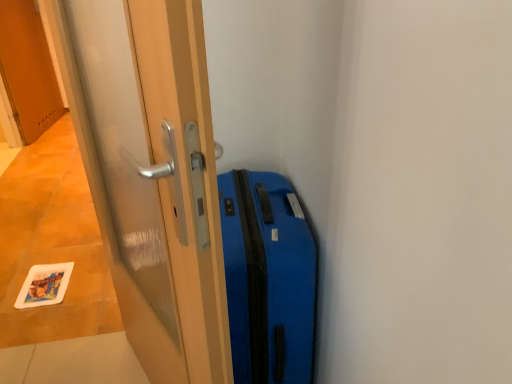
Question: Is transparent glass door at center, which ranks as the 2th door in back-to-front order, at the left side of blue matte suitcase at right?

Choices:
 (A) yes
 (B) no

Answer: (A)

Question: Does transparent glass door at center, marked as the second door in a left-to-right arrangement, have a greater height compared to blue matte suitcase at right?

Choices:
 (A) no
 (B) yes

Answer: (B)

Question: From the image's perspective, is transparent glass door at center, positioned as the second door in top-to-bottom order, on blue matte suitcase at right?

Choices:
 (A) yes
 (B) no

Answer: (A)

Question: Considering the relative sizes of transparent glass door at center, marked as the second door in a left-to-right arrangement, and blue matte suitcase at right in the image provided, is transparent glass door at center, marked as the second door in a left-to-right arrangement, smaller than blue matte suitcase at right?

Choices:
 (A) yes
 (B) no

Answer: (B)

Question: Would you consider transparent glass door at center, arranged as the 1th door when viewed from the front, to be distant from blue matte suitcase at right?

Choices:
 (A) no
 (B) yes

Answer: (A)

Question: Considering the positions of blue matte suitcase at right and wooden door at upper left, acting as the 1th door starting from the top, in the image, is blue matte suitcase at right taller or shorter than wooden door at upper left, acting as the 1th door starting from the top,?

Choices:
 (A) tall
 (B) short

Answer: (B)

Question: Does point (270, 278) appear closer or farther from the camera than point (42, 44)?

Choices:
 (A) closer
 (B) farther

Answer: (A)

Question: From a real-world perspective, is blue matte suitcase at right physically located above or below wooden door at upper left, the second door in the right-to-left sequence?

Choices:
 (A) above
 (B) below

Answer: (B)

Question: Would you say blue matte suitcase at right is to the left or to the right of wooden door at upper left, the second door in the right-to-left sequence, in the picture?

Choices:
 (A) left
 (B) right

Answer: (B)

Question: Visually, is wooden door at upper left, acting as the 1th door starting from the top, positioned to the left or to the right of transparent glass door at center, which is the first door in right-to-left order?

Choices:
 (A) right
 (B) left

Answer: (B)

Question: Is point (48, 49) closer or farther from the camera than point (159, 354)?

Choices:
 (A) farther
 (B) closer

Answer: (A)

Question: Would you say wooden door at upper left, marked as the 2th door in a front-to-back arrangement, is inside or outside transparent glass door at center, positioned as the second door in top-to-bottom order?

Choices:
 (A) inside
 (B) outside

Answer: (B)

Question: From the image's perspective, is wooden door at upper left, the second door ordered from the bottom, above or below transparent glass door at center, which is the first door in right-to-left order?

Choices:
 (A) above
 (B) below

Answer: (A)

Question: From the image's perspective, is transparent glass door at center, which is the first door in right-to-left order, positioned above or below wooden door at upper left, which is the first door in left-to-right order?

Choices:
 (A) below
 (B) above

Answer: (A)

Question: Relative to wooden door at upper left, the second door in the right-to-left sequence, is transparent glass door at center, marked as the second door in a left-to-right arrangement, in front or behind?

Choices:
 (A) front
 (B) behind

Answer: (A)